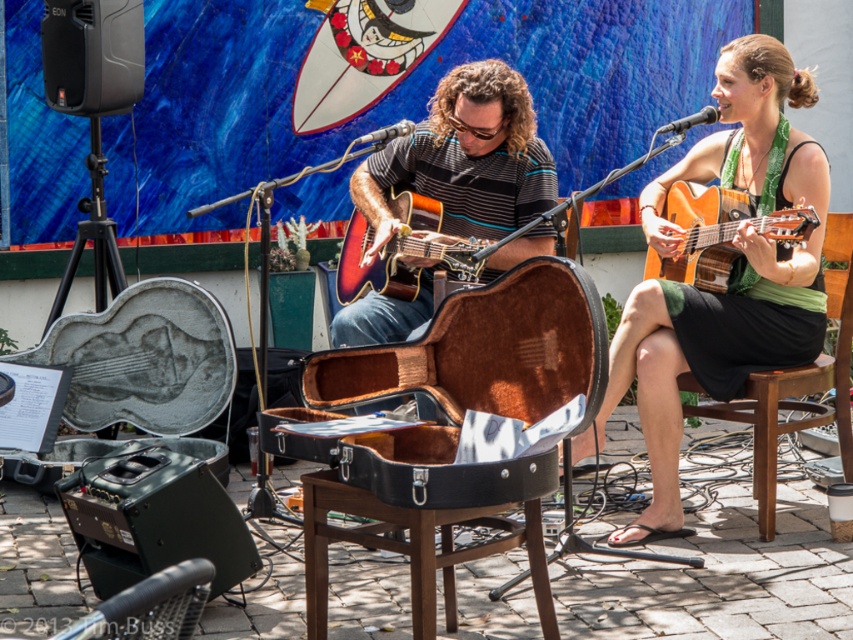
You are a photographer standing at the center of the scene. You want to take a photo of the acoustic wood guitar at right. Where should you aim your camera to capture it?

You should aim your camera at the coordinates point (718, 236) to capture the acoustic wood guitar at right.

You are standing at the back of the stage and want to move towards the front. You see two points marked on the stage, point (318, 497) and point (772, 228). Which point should you walk towards to get closer to the front of the stage?

You should walk towards point (318, 497) because it is in front of point (772, 228), meaning it is closer to the front of the stage.

You are a photographer trying to capture both the green fabric dress at center and the sunburst wood guitar at center in a single frame. Which object will appear larger in the photo?

The green fabric dress at center will appear larger in the photo because it is bigger than the sunburst wood guitar at center.